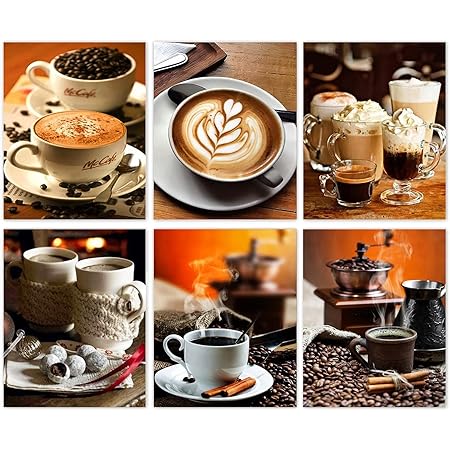
This screenshot has width=450, height=450. What are the coordinates of `white cups of coffee` in the screenshot? It's located at (220, 359), (106, 281), (56, 276), (84, 145), (95, 79).